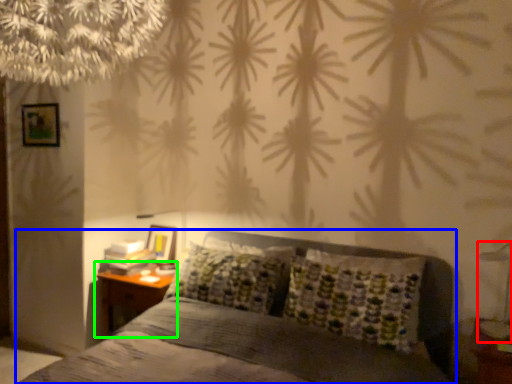
Question: Considering the real-world distances, which object is farthest from bedside lamp (highlighted by a red box)? bed (highlighted by a blue box) or nightstand (highlighted by a green box)?

Choices:
 (A) bed
 (B) nightstand

Answer: (B)